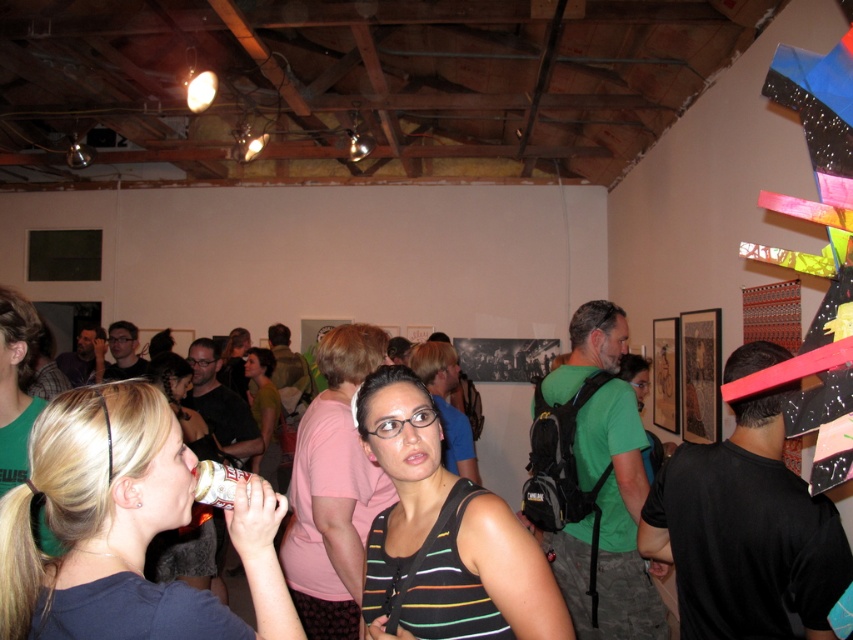
Can you confirm if white matte cup at center is shorter than matte green shirt at center?

Indeed, white matte cup at center has a lesser height compared to matte green shirt at center.

Which is in front, point (149, 556) or point (254, 397)?

Point (149, 556)

Which is behind, point (180, 534) or point (265, 348)?

The point (265, 348) is more distant.

At what (x,y) coordinates should I click in order to perform the action: click on white matte cup at center. Please return your answer as a coordinate pair (x, y). Looking at the image, I should click on (187, 554).

Looking at this image, does black striped tank top at center have a greater width compared to white matte cup at center?

Correct, the width of black striped tank top at center exceeds that of white matte cup at center.

Which of these two, black striped tank top at center or white matte cup at center, stands taller?

white matte cup at center

Does point (521, 625) lie in front of point (201, 573)?

That is True.

I want to click on black striped tank top at center, so click(444, 534).

Is black striped tank top at center to the right of matte green shirt at center from the viewer's perspective?

Indeed, black striped tank top at center is positioned on the right side of matte green shirt at center.

Which is below, black striped tank top at center or matte green shirt at center?

matte green shirt at center is lower down.

This screenshot has width=853, height=640. Identify the location of black striped tank top at center. (444, 534).

The height and width of the screenshot is (640, 853). In order to click on black striped tank top at center in this screenshot , I will do `click(444, 534)`.